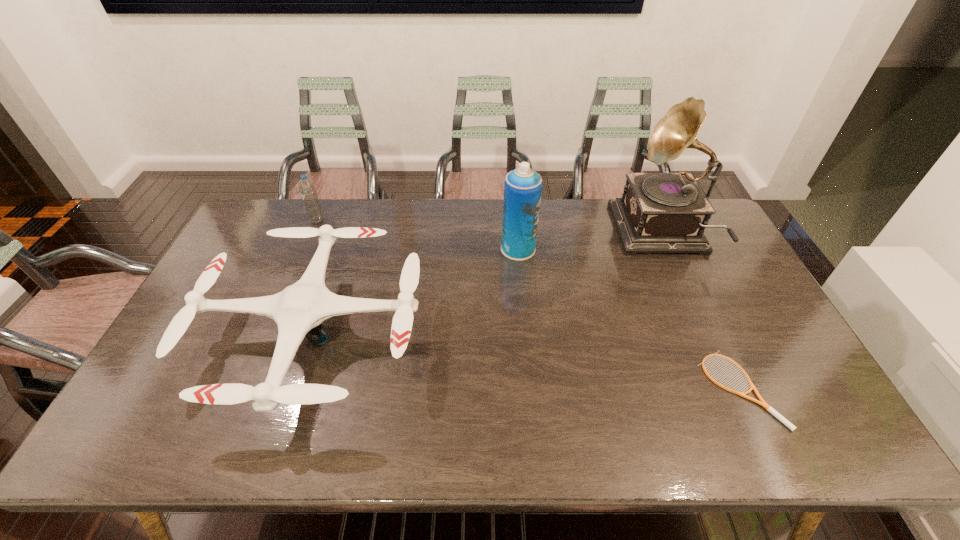
Identify the location of tennis racket that is at the right edge. coord(762,403).

Identify the location of object situated at the near left corner. (299, 310).

Where is `object that is at the far right corner`? The image size is (960, 540). object that is at the far right corner is located at coordinates (659, 212).

Find the location of `object located in the near right corner section of the desktop`. object located in the near right corner section of the desktop is located at coordinates (762, 403).

Find the location of a particular element. The height and width of the screenshot is (540, 960). free space at the far edge is located at coordinates (383, 203).

Where is `vacant space at the near edge of the desktop`? This screenshot has height=540, width=960. vacant space at the near edge of the desktop is located at coordinates (513, 416).

The width and height of the screenshot is (960, 540). Identify the location of vacant space at the left edge of the desktop. (273, 258).

You are a GUI agent. You are given a task and a screenshot of the screen. Output one action in this format:
    pyautogui.click(x=<x>, y=<y>)
    Task: Click on the vacant space at the right edge of the desktop
    The width and height of the screenshot is (960, 540).
    Given the screenshot: What is the action you would take?
    tap(771, 403)

Where is `vacant space at the near right corner of the desktop`? vacant space at the near right corner of the desktop is located at coordinates (777, 427).

The width and height of the screenshot is (960, 540). I want to click on empty space between the tallest object and the drone, so click(x=488, y=284).